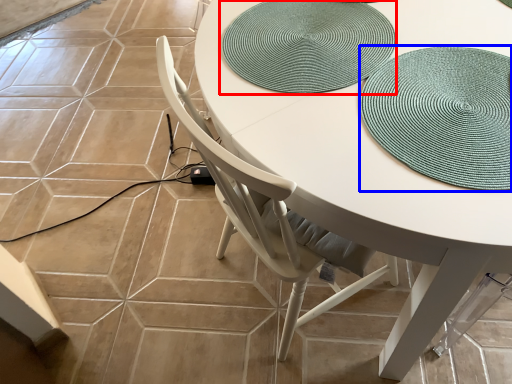
Question: Which of the following is the farthest to the observer, mat (highlighted by a red box) or hat (highlighted by a blue box)?

Choices:
 (A) mat
 (B) hat

Answer: (A)